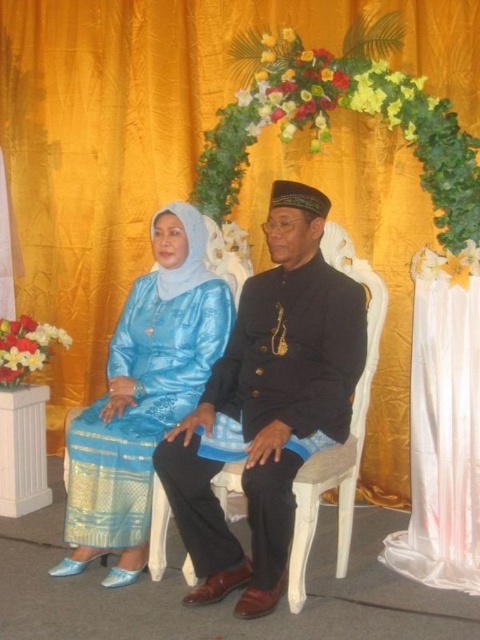
Is the position of black satin suit at center less distant than that of satin blue dress at center?

Yes, black satin suit at center is in front of satin blue dress at center.

Does black satin suit at center have a lesser width compared to satin blue dress at center?

No, black satin suit at center is not thinner than satin blue dress at center.

This screenshot has height=640, width=480. I want to click on black satin suit at center, so click(x=267, y=404).

Where is `black satin suit at center`? This screenshot has height=640, width=480. black satin suit at center is located at coordinates (267, 404).

From the picture: Who is lower down, satin blue dress at center or white satin curtain at right?

white satin curtain at right is lower down.

Can you confirm if satin blue dress at center is wider than white satin curtain at right?

Correct, the width of satin blue dress at center exceeds that of white satin curtain at right.

Does point (189, 211) lie behind point (414, 346)?

Yes, point (189, 211) is behind point (414, 346).

Where is `satin blue dress at center`? The image size is (480, 640). satin blue dress at center is located at coordinates (144, 396).

Can you confirm if black satin suit at center is positioned to the left of white satin curtain at right?

Yes, black satin suit at center is to the left of white satin curtain at right.

Who is positioned more to the left, black satin suit at center or white satin curtain at right?

From the viewer's perspective, black satin suit at center appears more on the left side.

Is point (276, 266) positioned behind point (472, 420)?

Yes, it is behind point (472, 420).

Find the location of a particular element. The width and height of the screenshot is (480, 640). black satin suit at center is located at coordinates (267, 404).